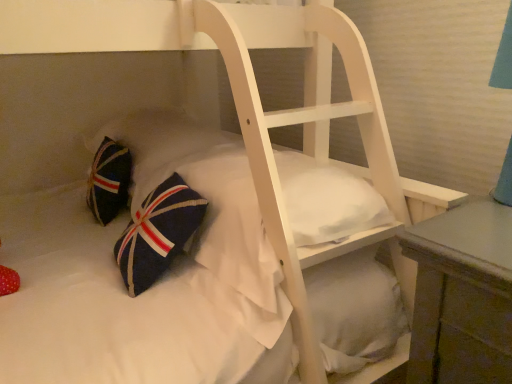
Question: Is navy blue fabric pillow at lower left taller or shorter than navy blue fabric pillow at lower left?

Choices:
 (A) short
 (B) tall

Answer: (B)

Question: Is navy blue fabric pillow at lower left bigger or smaller than navy blue fabric pillow at lower left?

Choices:
 (A) big
 (B) small

Answer: (B)

Question: Is navy blue fabric pillow at lower left wider or thinner than navy blue fabric pillow at lower left?

Choices:
 (A) thin
 (B) wide

Answer: (A)

Question: Is navy blue fabric pillow at lower left taller or shorter than navy blue fabric pillow at lower left?

Choices:
 (A) tall
 (B) short

Answer: (B)

Question: Is navy blue fabric pillow at lower left in front of or behind navy blue fabric pillow at lower left in the image?

Choices:
 (A) behind
 (B) front

Answer: (A)

Question: Would you say navy blue fabric pillow at lower left is to the left or to the right of navy blue fabric pillow at lower left in the picture?

Choices:
 (A) right
 (B) left

Answer: (B)

Question: From the image's perspective, is navy blue fabric pillow at lower left above or below navy blue fabric pillow at lower left?

Choices:
 (A) below
 (B) above

Answer: (B)